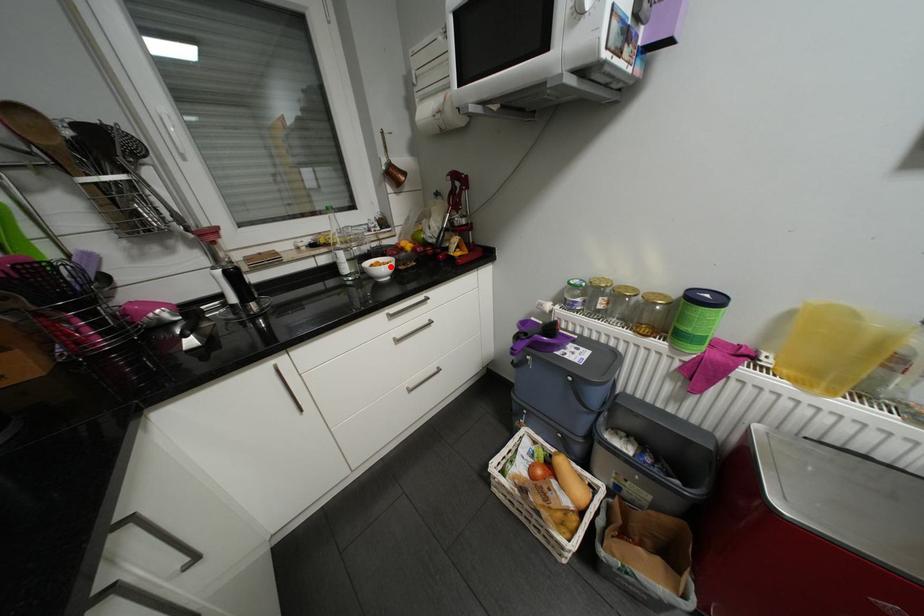
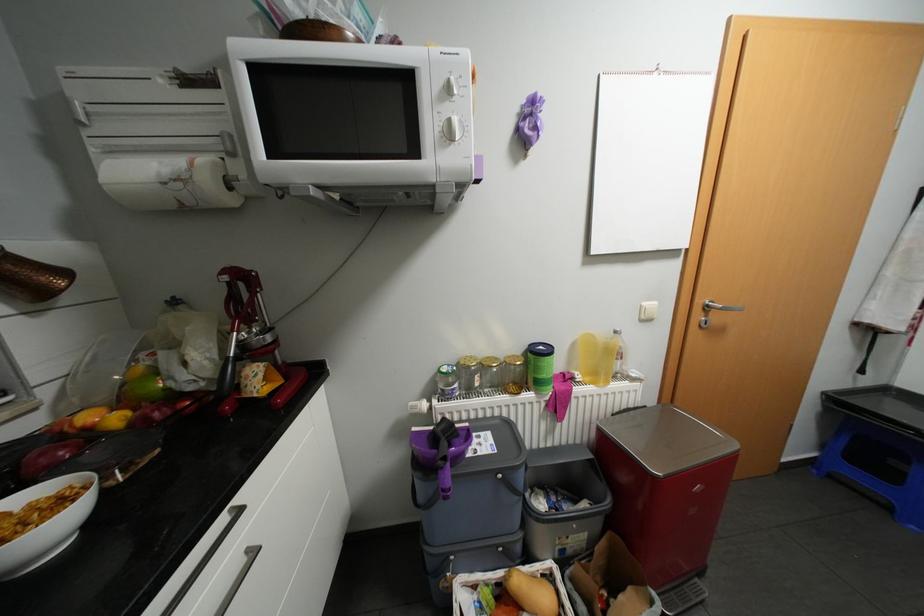
In the second image, find the point that corresponds to the highlighted location in the first image.

(44, 522)